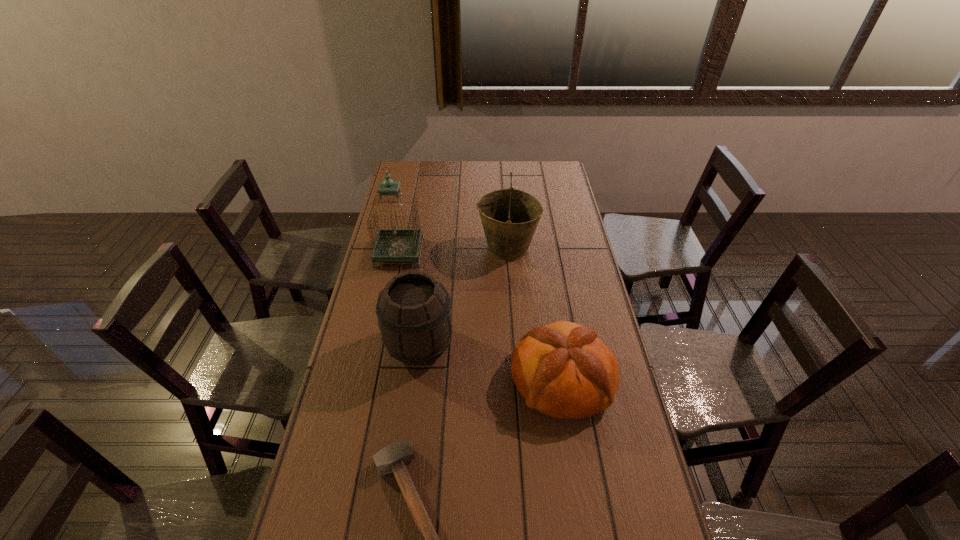
Locate an element on the screen. This screenshot has width=960, height=540. birdcage is located at coordinates (391, 245).

Image resolution: width=960 pixels, height=540 pixels. Identify the location of the taller wine bucket. (510, 217).

Identify the location of the right wine bucket. (510, 217).

Locate an element on the screen. The height and width of the screenshot is (540, 960). the nearer wine bucket is located at coordinates [414, 314].

Locate an element on the screen. the shorter wine bucket is located at coordinates (414, 314).

At what (x,y) coordinates should I click in order to perform the action: click on the second shortest object. Please return your answer as a coordinate pair (x, y). Looking at the image, I should click on (562, 370).

Where is `free point located 0.160m at the door of the birdcage`? This screenshot has height=540, width=960. free point located 0.160m at the door of the birdcage is located at coordinates (462, 253).

Where is `vacant position located 0.140m on the back of the taller wine bucket`? vacant position located 0.140m on the back of the taller wine bucket is located at coordinates (505, 212).

The height and width of the screenshot is (540, 960). I want to click on vacant area situated 0.060m on the back of the nearer wine bucket, so click(x=424, y=308).

Locate an element on the screen. The image size is (960, 540). free region located 0.070m on the front of the bread is located at coordinates (573, 451).